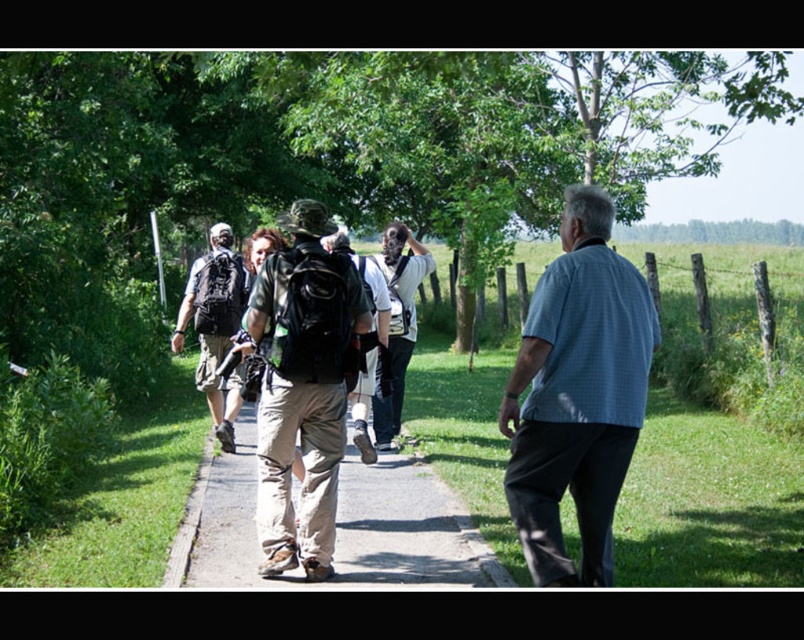
Consider the image. You are a photographer standing at the camera position. You want to take a picture of the blue checkered shirt at right and the white shirt at center. Which of the two shirts will appear closer to the bottom of the photo?

The blue checkered shirt at right will appear closer to the bottom of the photo because it is positioned under the white shirt at center.

You are standing at the origin point of the coordinate system. You see a man in a light blue checkered shirt and dark trousers walking towards a group of four individuals ahead of him. There is a point marked at coordinate (302,387). What object is located at that coordinate?

The point at coordinate (302,387) indicates khaki cotton pants at center.